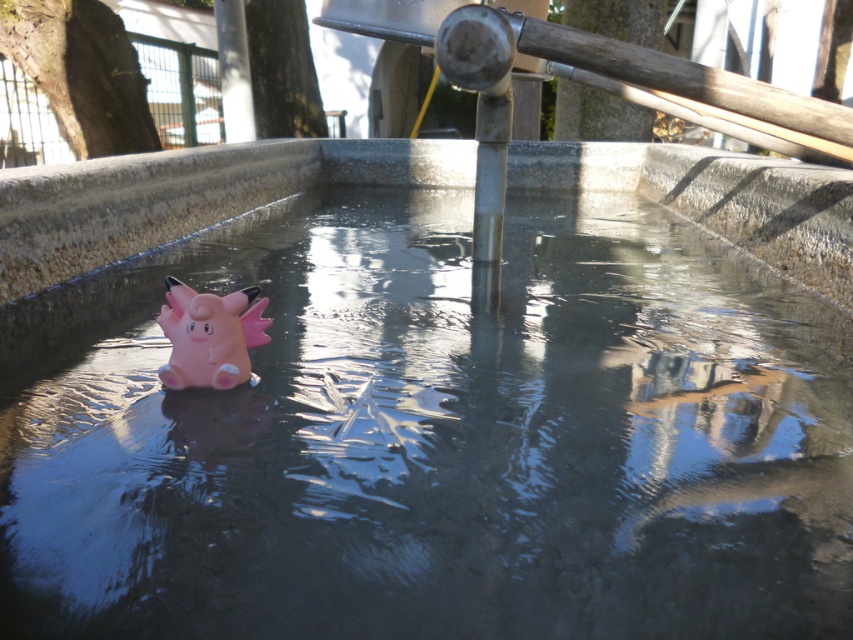
You are a maintenance worker checking the water basin. You need to ensure the distance between the transparent water at center and the pink rubber toy at center is at least 50 centimeters to prevent overflow. Is the current distance sufficient?

The transparent water at center is 46.02 centimeters from the pink rubber toy at center, which is less than the required 50 centimeters. Therefore, the current distance is insufficient to prevent overflow.

You are standing in front of a water basin and see the transparent water at center and the pink rubber toy at center. Which object is located to the right of the other?

The transparent water at center is to the right of the pink rubber toy at center.

You are a child who is 36 inches tall and standing at the edge of the water basin. You want to reach the transparent water at center to splash it. Can you safely reach the water without leaning too far forward?

The transparent water at center is 27.25 inches away from the viewer. Since the child is 36 inches tall, they can safely reach the water without leaning too far forward as the distance is within a comfortable reach.